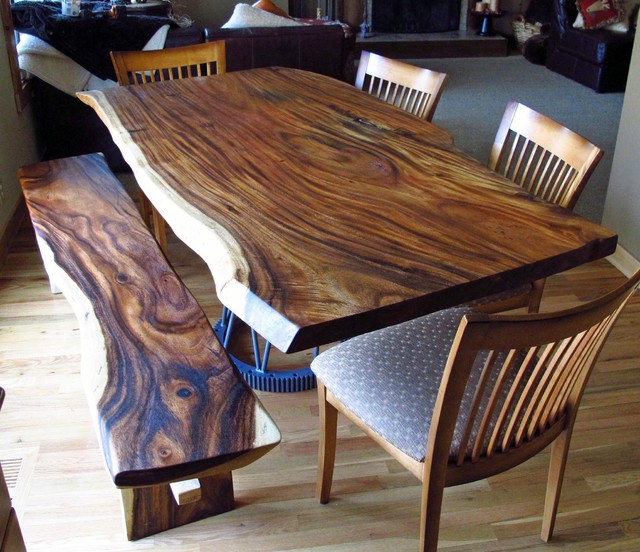
You are a GUI agent. You are given a task and a screenshot of the screen. Output one action in this format:
    pyautogui.click(x=<x>, y=<y>)
    Task: Click on the vent
    
    Given the screenshot: What is the action you would take?
    pyautogui.click(x=9, y=470)